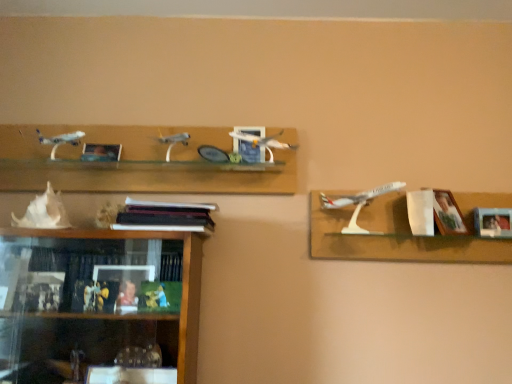
Question: Does white plastic airplane at right have a lesser height compared to white shell at lower left?

Choices:
 (A) yes
 (B) no

Answer: (B)

Question: Is white plastic airplane at right with white shell at lower left?

Choices:
 (A) no
 (B) yes

Answer: (A)

Question: Considering the relative sizes of white plastic airplane at right and white shell at lower left in the image provided, is white plastic airplane at right thinner than white shell at lower left?

Choices:
 (A) yes
 (B) no

Answer: (B)

Question: Could you tell me if white plastic airplane at right is facing white shell at lower left?

Choices:
 (A) yes
 (B) no

Answer: (B)

Question: Is white shell at lower left located within white plastic airplane at right?

Choices:
 (A) no
 (B) yes

Answer: (A)

Question: From the image's perspective, is white plastic airplane at right over white shell at lower left?

Choices:
 (A) no
 (B) yes

Answer: (A)

Question: From a real-world perspective, is wooden photo frame at right, arranged as the 1th picture frame when viewed from the right, located higher than matte blue picture frame at center, marked as the 2th picture frame in a left-to-right arrangement?

Choices:
 (A) yes
 (B) no

Answer: (B)

Question: Is wooden photo frame at right, arranged as the 1th picture frame when viewed from the right, positioned with its back to matte blue picture frame at center, marked as the 2th picture frame in a left-to-right arrangement?

Choices:
 (A) yes
 (B) no

Answer: (B)

Question: Could you tell me if wooden photo frame at right, arranged as the 1th picture frame when viewed from the right, is turned towards matte blue picture frame at center, marked as the 2th picture frame in a left-to-right arrangement?

Choices:
 (A) yes
 (B) no

Answer: (B)

Question: Can you confirm if wooden photo frame at right, the fourth picture frame when ordered from left to right, is thinner than matte blue picture frame at center, marked as the 2th picture frame in a left-to-right arrangement?

Choices:
 (A) no
 (B) yes

Answer: (A)

Question: Does wooden photo frame at right, the fourth picture frame when ordered from left to right, have a lesser height compared to matte blue picture frame at center, marked as the 2th picture frame in a left-to-right arrangement?

Choices:
 (A) no
 (B) yes

Answer: (B)

Question: Does wooden photo frame at right, arranged as the 1th picture frame when viewed from the right, have a greater height compared to matte blue picture frame at center, marked as the 2th picture frame in a left-to-right arrangement?

Choices:
 (A) no
 (B) yes

Answer: (A)

Question: Is wooden picture frame at right, placed as the 3th picture frame when sorted from left to right, wider than white plastic airplane at right?

Choices:
 (A) no
 (B) yes

Answer: (A)